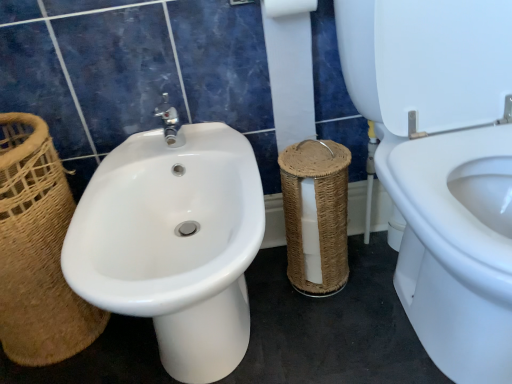
You are a GUI agent. You are given a task and a screenshot of the screen. Output one action in this format:
    pyautogui.click(x=<x>, y=<y>)
    Task: Click on the blank space above woven brown basket at center (from a real-world perspective)
    
    Given the screenshot: What is the action you would take?
    pyautogui.click(x=314, y=154)